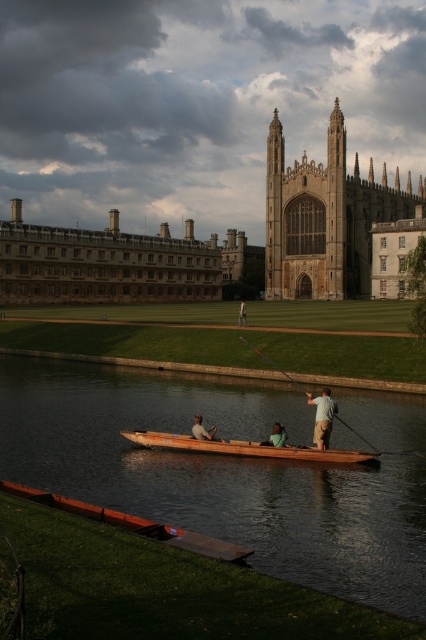
You are standing on the riverbank and want to know which of the two points, point [100,493] or point [279,369], is closer to you. Can you determine this based on the scene?

Point [100,493] is closer to the viewer than point [279,369].

You are standing on the riverbank observing the punt boat. Which of the two points, point (x=253, y=486) or point (x=278, y=284), is closer to you?

Point (x=253, y=486) is in front of point (x=278, y=284), so it is closer to you.

You are planning to take a photo of the brown wooden boat at lower center and the stone gothic cathedral at center from the riverbank. Which object should you focus on first if you want to capture both in a single frame without moving the camera? Explain your reasoning based on their sizes.

The brown wooden boat at lower center is larger in size than the stone gothic cathedral at center. Therefore, you should focus on the brown wooden boat at lower center first to ensure it fits properly in the frame before adjusting for the smaller cathedral.